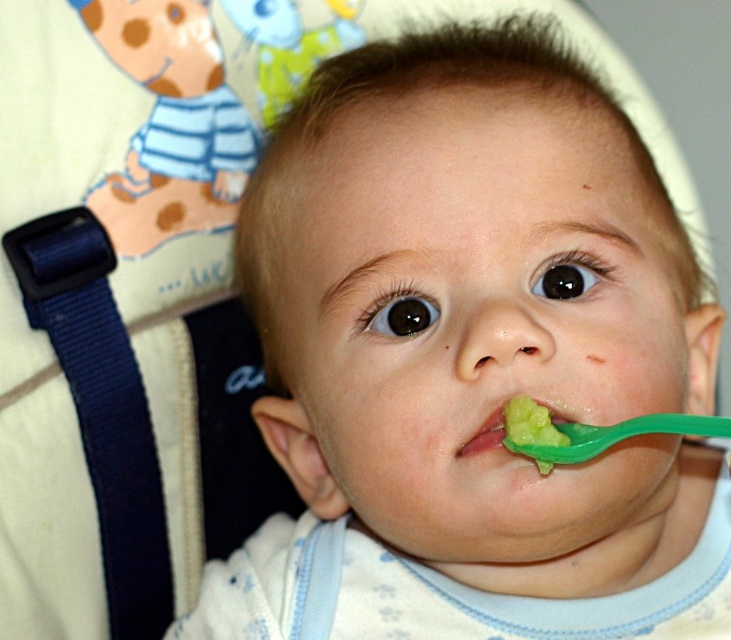
Question: Is the position of green plastic spoon at mouth more distant than that of green plastic spoon at lower center?

Choices:
 (A) yes
 (B) no

Answer: (B)

Question: Which point is farther to the camera?

Choices:
 (A) (523, 442)
 (B) (515, 412)

Answer: (B)

Question: Which of the following is the farthest from the observer?

Choices:
 (A) (588, 452)
 (B) (518, 426)

Answer: (B)

Question: Where is green plastic spoon at mouth located in relation to green plastic spoon at lower center in the image?

Choices:
 (A) above
 (B) below

Answer: (B)

Question: Does green plastic spoon at mouth appear on the left side of green plastic spoon at lower center?

Choices:
 (A) no
 (B) yes

Answer: (A)